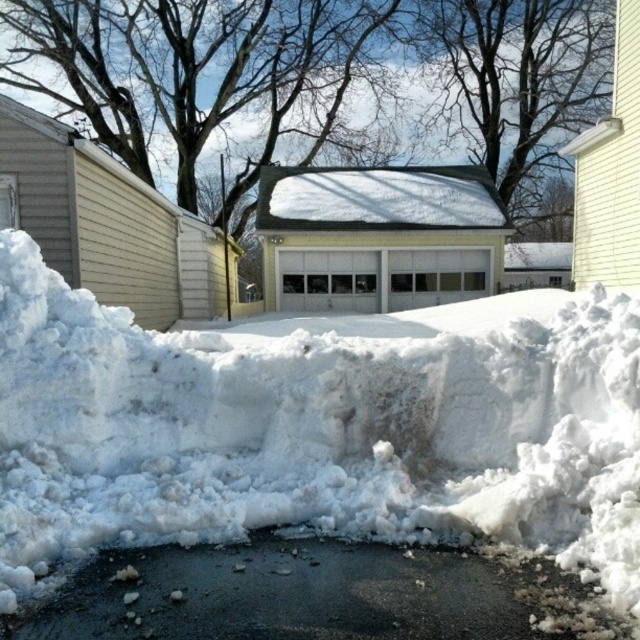
In the scene shown: Does white fluffy snow at center come in front of black asphalt at center?

No, it is not.

Who is more distant from viewer, (67,451) or (525,620)?

The point (67,451) is behind.

Is point (252, 364) positioned before point (385, 596)?

That is False.

This screenshot has width=640, height=640. I want to click on white fluffy snow at center, so click(316, 429).